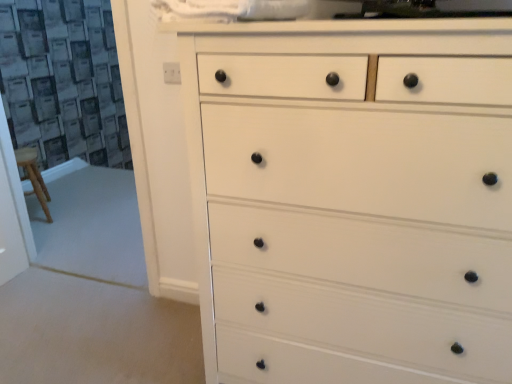
Where is `white painted wood chest of drawers at center`? The width and height of the screenshot is (512, 384). white painted wood chest of drawers at center is located at coordinates (352, 198).

This screenshot has width=512, height=384. Describe the element at coordinates (352, 198) in the screenshot. I see `white painted wood chest of drawers at center` at that location.

At what (x,y) coordinates should I click in order to perform the action: click on black plastic knob at upper left. Please return your answer as a coordinate pair (x, y). Image resolution: width=512 pixels, height=384 pixels. Looking at the image, I should click on (170, 73).

The height and width of the screenshot is (384, 512). Describe the element at coordinates (170, 73) in the screenshot. I see `black plastic knob at upper left` at that location.

Where is `white painted wood chest of drawers at center`? The width and height of the screenshot is (512, 384). white painted wood chest of drawers at center is located at coordinates (352, 198).

Considering the relative positions of black plastic knob at upper left and white painted wood chest of drawers at center in the image provided, is black plastic knob at upper left to the left or to the right of white painted wood chest of drawers at center?

Based on their positions, black plastic knob at upper left is located to the left of white painted wood chest of drawers at center.

Is black plastic knob at upper left positioned in front of white painted wood chest of drawers at center?

No, black plastic knob at upper left is further to the viewer.

Which is closer, (170, 70) or (370, 317)?

Point (170, 70) is farther from the camera than point (370, 317).

From the image's perspective, is black plastic knob at upper left above white painted wood chest of drawers at center?

Indeed, from the image's perspective, black plastic knob at upper left is shown above white painted wood chest of drawers at center.

From a real-world perspective, is black plastic knob at upper left on white painted wood chest of drawers at center?

Correct, in the physical world, black plastic knob at upper left is higher than white painted wood chest of drawers at center.

Based on the photo, can you confirm if black plastic knob at upper left is wider than white painted wood chest of drawers at center?

No.

Can you confirm if black plastic knob at upper left is taller than white painted wood chest of drawers at center?

No.

Considering the sizes of objects black plastic knob at upper left and white painted wood chest of drawers at center in the image provided, who is bigger, black plastic knob at upper left or white painted wood chest of drawers at center?

white painted wood chest of drawers at center is bigger.

Based on the photo, choose the correct answer: Is black plastic knob at upper left inside white painted wood chest of drawers at center or outside it?

The correct answer is: outside.

Is black plastic knob at upper left beside white painted wood chest of drawers at center?

black plastic knob at upper left and white painted wood chest of drawers at center are clearly separated.

Could you tell me if black plastic knob at upper left is turned towards white painted wood chest of drawers at center?

No, black plastic knob at upper left is not oriented towards white painted wood chest of drawers at center.

How different are the orientations of black plastic knob at upper left and white painted wood chest of drawers at center in degrees?

They differ by 2.94 degrees in their facing directions.

You are a GUI agent. You are given a task and a screenshot of the screen. Output one action in this format:
    pyautogui.click(x=<x>, y=<y>)
    Task: Click on the chest of drawers that is on the right side of black plastic knob at upper left
    This screenshot has width=512, height=384.
    Given the screenshot: What is the action you would take?
    pyautogui.click(x=352, y=198)

Considering the positions of objects white painted wood chest of drawers at center and black plastic knob at upper left in the image provided, who is more to the right, white painted wood chest of drawers at center or black plastic knob at upper left?

white painted wood chest of drawers at center.

Which object is closer to the camera, white painted wood chest of drawers at center or black plastic knob at upper left?

white painted wood chest of drawers at center.

Is point (467, 94) closer to camera compared to point (178, 69)?

Yes.

Based on the photo, from the image's perspective, which one is positioned higher, white painted wood chest of drawers at center or black plastic knob at upper left?

black plastic knob at upper left is shown above in the image.

From a real-world perspective, is white painted wood chest of drawers at center over black plastic knob at upper left?

No, from a real-world perspective, white painted wood chest of drawers at center is not on top of black plastic knob at upper left.

Does white painted wood chest of drawers at center have a lesser width compared to black plastic knob at upper left?

No, white painted wood chest of drawers at center is not thinner than black plastic knob at upper left.

Does white painted wood chest of drawers at center have a greater height compared to black plastic knob at upper left?

Indeed, white painted wood chest of drawers at center has a greater height compared to black plastic knob at upper left.

Considering the relative sizes of white painted wood chest of drawers at center and black plastic knob at upper left in the image provided, is white painted wood chest of drawers at center bigger than black plastic knob at upper left?

A: Yes, white painted wood chest of drawers at center is bigger than black plastic knob at upper left.

Is black plastic knob at upper left a part of white painted wood chest of drawers at center?

No, white painted wood chest of drawers at center does not contain black plastic knob at upper left.

From the picture: Is white painted wood chest of drawers at center in contact with black plastic knob at upper left?

No.

Is white painted wood chest of drawers at center aimed at black plastic knob at upper left?

No, white painted wood chest of drawers at center is not facing towards black plastic knob at upper left.

What's the angular difference between white painted wood chest of drawers at center and black plastic knob at upper left's facing directions?

They differ by 2.94 degrees in their facing directions.

The height and width of the screenshot is (384, 512). I want to click on knob above the white painted wood chest of drawers at center (from a real-world perspective), so (170, 73).

At what (x,y) coordinates should I click in order to perform the action: click on the chest of drawers below the black plastic knob at upper left (from the image's perspective). Please return your answer as a coordinate pair (x, y). This screenshot has width=512, height=384. Looking at the image, I should click on (352, 198).

Identify the location of chest of drawers below the black plastic knob at upper left (from a real-world perspective). (352, 198).